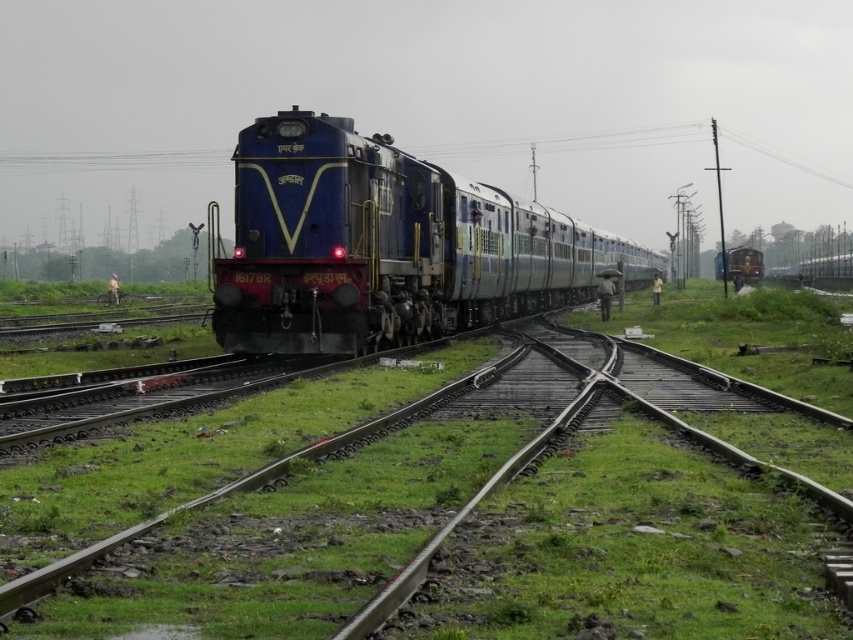
You are a railway worker checking the tracks. You see the smooth steel track at center and the polished brass steam engine at center. Which object is positioned to the left?

The smooth steel track at center is positioned to the left of the polished brass steam engine at center.

You are standing at the point labeled point (x=421, y=230) and want to walk to the point labeled point (x=813, y=532). Given the railway tracks diverge with one going straight and another branching to the right, which direction should you take to reach your destination?

Since point (x=813, y=532) is in front of point (x=421, y=230), you should follow the straight track ahead to reach your destination.